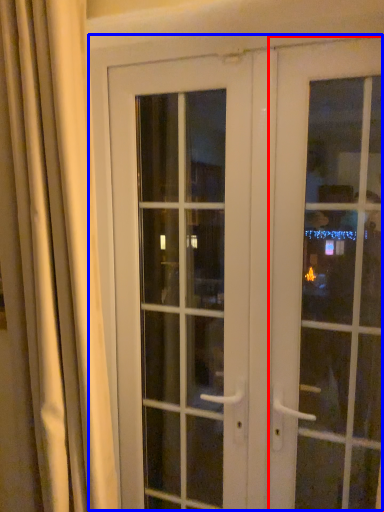
Question: Among these objects, which one is nearest to the camera, door (highlighted by a red box) or door (highlighted by a blue box)?

Choices:
 (A) door
 (B) door

Answer: (A)